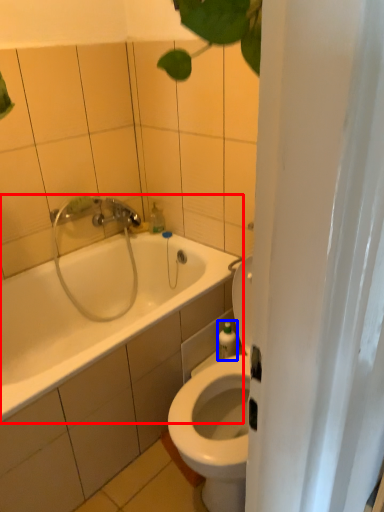
Question: Which of the following is the closest to the observer, bathtub (highlighted by a red box) or toiletry (highlighted by a blue box)?

Choices:
 (A) bathtub
 (B) toiletry

Answer: (A)